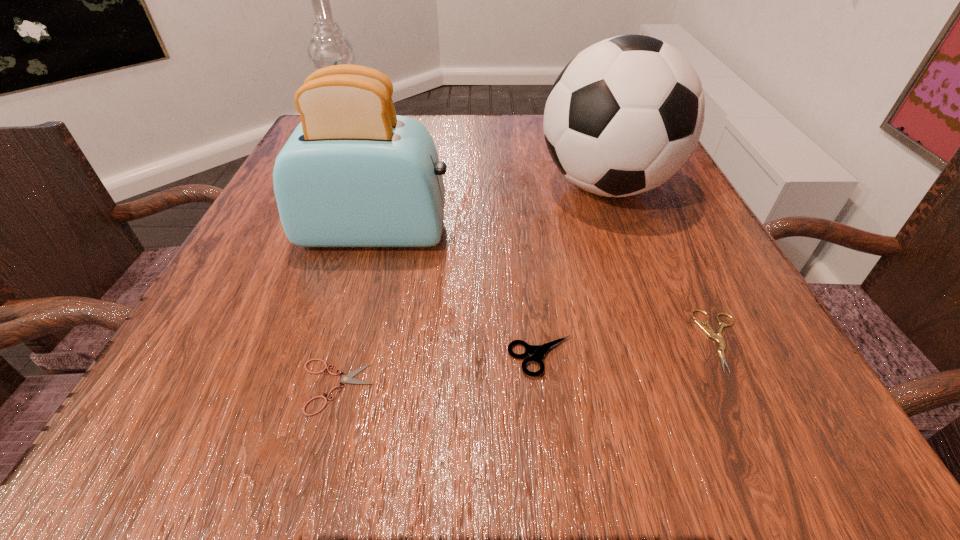
You are a GUI agent. You are given a task and a screenshot of the screen. Output one action in this format:
    pyautogui.click(x=<x>, y=<y>)
    Task: Click on the shears that stands as the second closest to the oil lamp
    This screenshot has width=960, height=540.
    Given the screenshot: What is the action you would take?
    pyautogui.click(x=538, y=351)

The image size is (960, 540). What are the coordinates of `the second closest shears to the leftmost shears` in the screenshot? It's located at [x=709, y=331].

Find the location of a particular element. This screenshot has height=540, width=960. free spot that satisfies the following two spatial constraints: 1. on the side of the toaster with the lever; 2. on the left side of the third shortest object is located at coordinates (342, 357).

I want to click on free space that satisfies the following two spatial constraints: 1. on the back side of the shortest shears; 2. on the right side of the fourth tallest object, so click(344, 357).

Locate an element on the screen. The image size is (960, 540). vacant position in the image that satisfies the following two spatial constraints: 1. on the side of the toaster with the lever; 2. on the back side of the second shears from left to right is located at coordinates (342, 357).

You are a GUI agent. You are given a task and a screenshot of the screen. Output one action in this format:
    pyautogui.click(x=<x>, y=<y>)
    Task: Click on the vacant area in the image that satisfies the following two spatial constraints: 1. on the back side of the shortest shears; 2. on the side of the toaster with the lever
    The width and height of the screenshot is (960, 540).
    Given the screenshot: What is the action you would take?
    pyautogui.click(x=377, y=232)